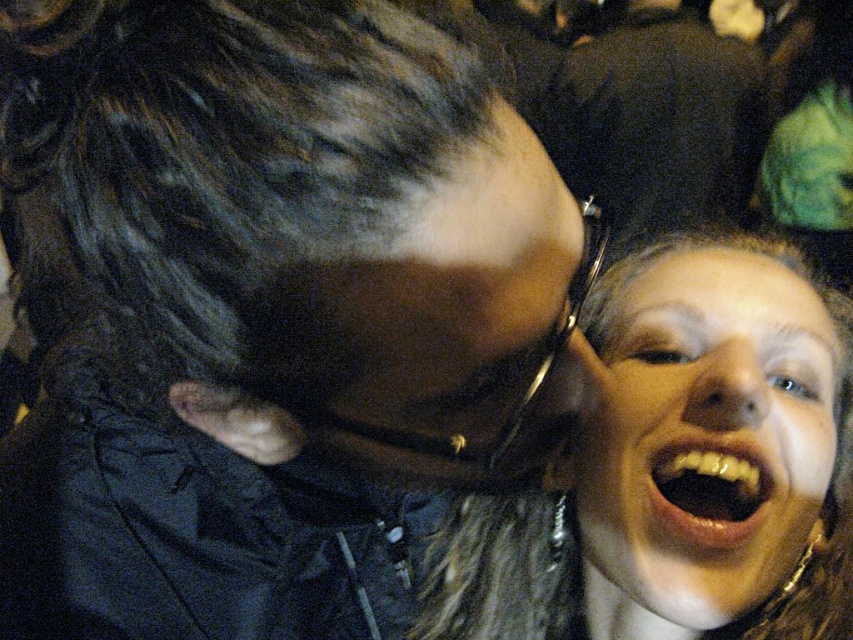
You are a photographer trying to capture a detailed closeup of the black matte hair at upper left and the smooth glossy teeth at lower right. Since the camera can only focus on one object at a time, which object should you choose to ensure it appears larger in the photo?

The black matte hair at upper left is bigger than the smooth glossy teeth at lower right, so you should focus on the black matte hair at upper left to ensure it appears larger in the photo.